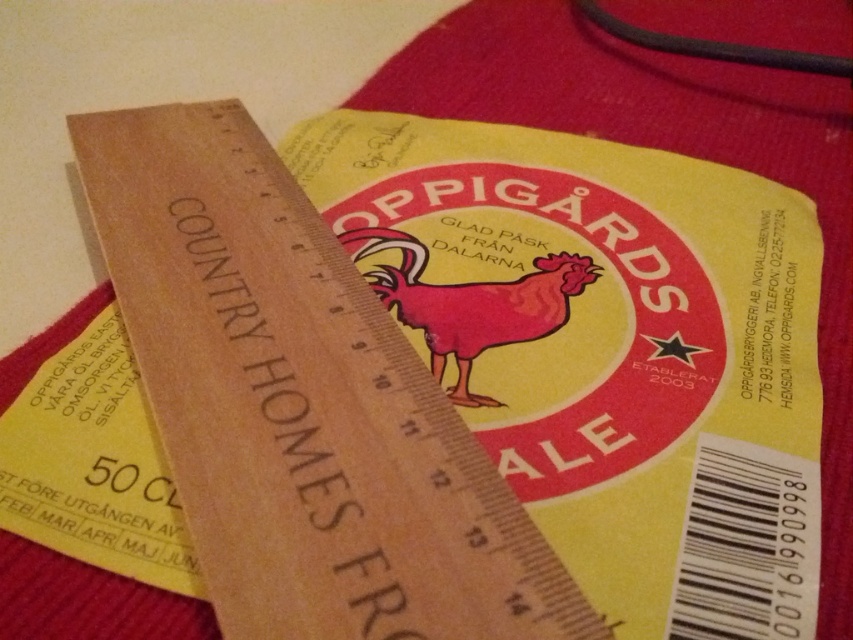
Question: Which object is farther from the camera taking this photo?

Choices:
 (A) matte red chicken at center
 (B) wooden ruler at center

Answer: (A)

Question: From the image, what is the correct spatial relationship of wooden ruler at center in relation to matte red chicken at center?

Choices:
 (A) right
 (B) left

Answer: (B)

Question: Which point is farther to the camera?

Choices:
 (A) (526, 323)
 (B) (274, 449)

Answer: (A)

Question: From the image, what is the correct spatial relationship of wooden ruler at center in relation to matte red chicken at center?

Choices:
 (A) right
 (B) left

Answer: (B)

Question: Does wooden ruler at center have a greater width compared to matte red chicken at center?

Choices:
 (A) yes
 (B) no

Answer: (A)